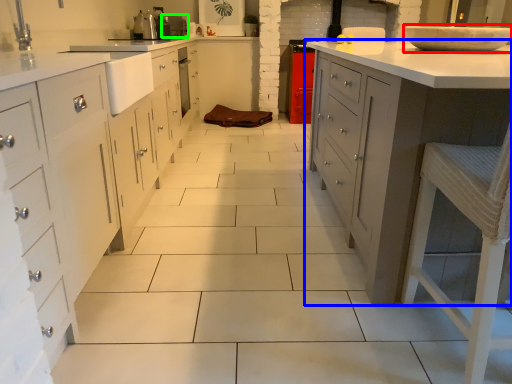
Question: Based on their relative distances, which object is nearer to home appliance (highlighted by a red box)? Choose from countertop (highlighted by a blue box) and appliance (highlighted by a green box).

Choices:
 (A) countertop
 (B) appliance

Answer: (A)